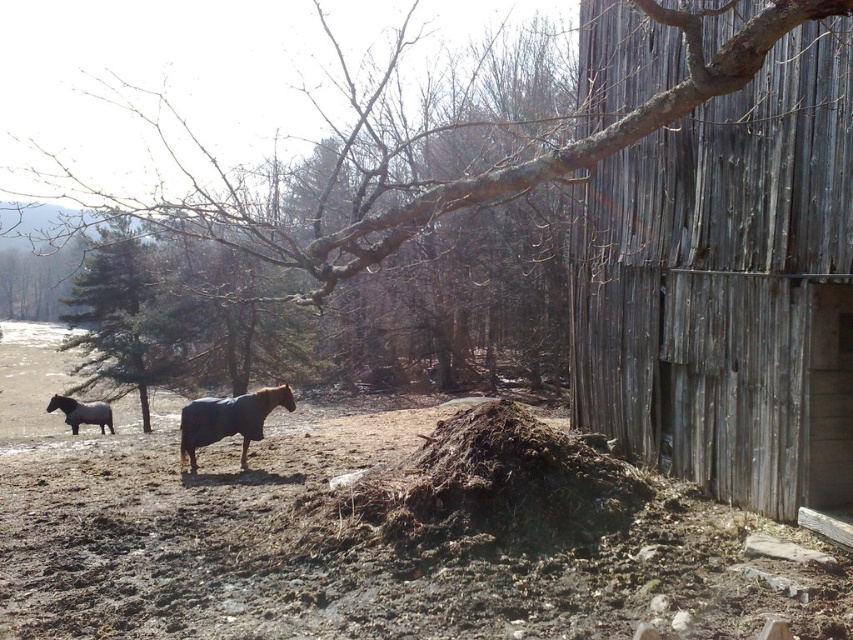
Consider the image. Can you confirm if brown bark tree at center is smaller than dark brown glossy horse at lower left?

Incorrect, brown bark tree at center is not smaller in size than dark brown glossy horse at lower left.

Which is in front, point (257, 204) or point (55, 401)?

Positioned in front is point (55, 401).

I want to click on brown bark tree at center, so click(x=407, y=154).

From the picture: Is weathered wood barn at right above dark brown glossy horse at lower left?

Correct, weathered wood barn at right is located above dark brown glossy horse at lower left.

Consider the image. Who is positioned more to the right, weathered wood barn at right or dark brown glossy horse at lower left?

weathered wood barn at right is more to the right.

Identify the location of weathered wood barn at right. The height and width of the screenshot is (640, 853). (728, 285).

At what (x,y) coordinates should I click in order to perform the action: click on weathered wood barn at right. Please return your answer as a coordinate pair (x, y). Looking at the image, I should click on (728, 285).

Describe the element at coordinates (123, 317) in the screenshot. I see `green textured pine tree at left` at that location.

Based on the photo, measure the distance between green textured pine tree at left and camera.

green textured pine tree at left is 24.76 meters from camera.

Identify the location of green textured pine tree at left. This screenshot has width=853, height=640. (123, 317).